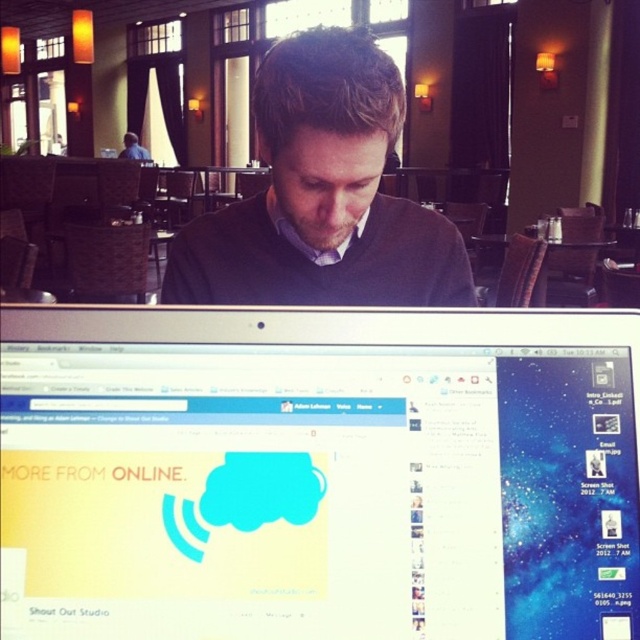
Does dark gray sweater at center have a greater width compared to wooden table at center?

No, dark gray sweater at center is not wider than wooden table at center.

Is point (288, 131) closer to viewer compared to point (586, 243)?

Yes, it is.

The image size is (640, 640). Identify the location of dark gray sweater at center. (323, 195).

Does point (307, 76) lie behind point (129, 156)?

No.

Find the location of a particular element. dark gray sweater at center is located at coordinates (323, 195).

Does point (209, 508) come behind point (509, 237)?

No, (209, 508) is closer to viewer.

In order to click on satin black monitor at center in this screenshot , I will do `click(317, 472)`.